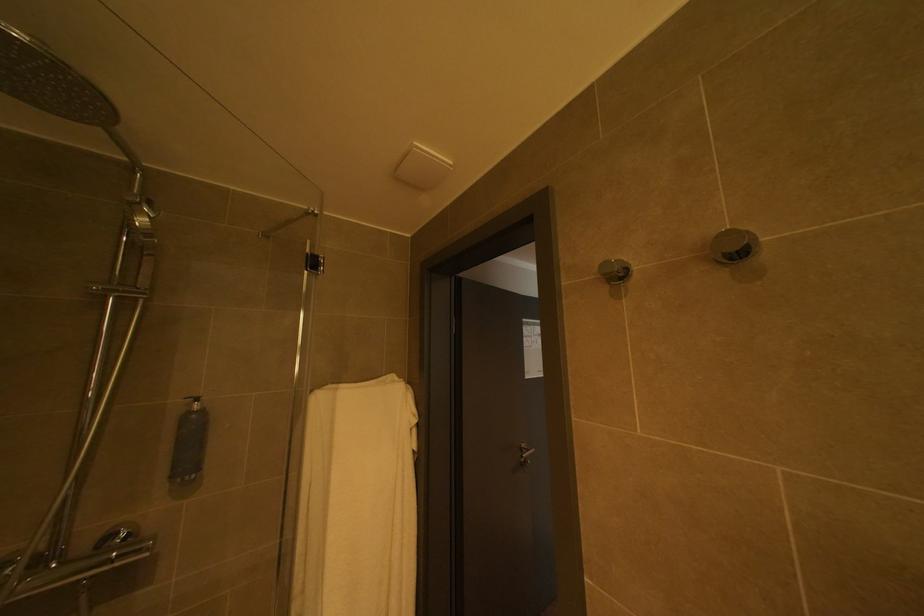
Locate an element on the screen. The image size is (924, 616). shower wand is located at coordinates (146, 267).